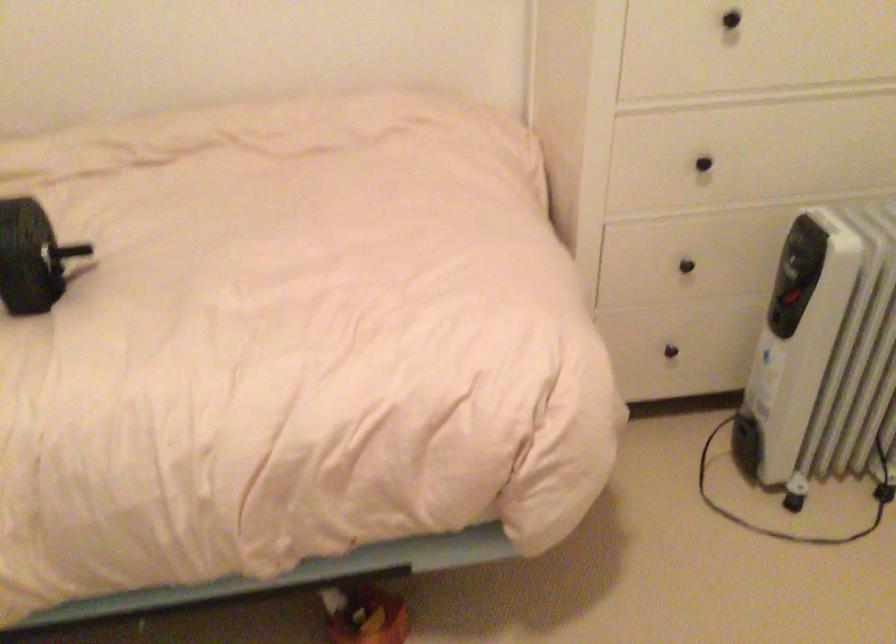
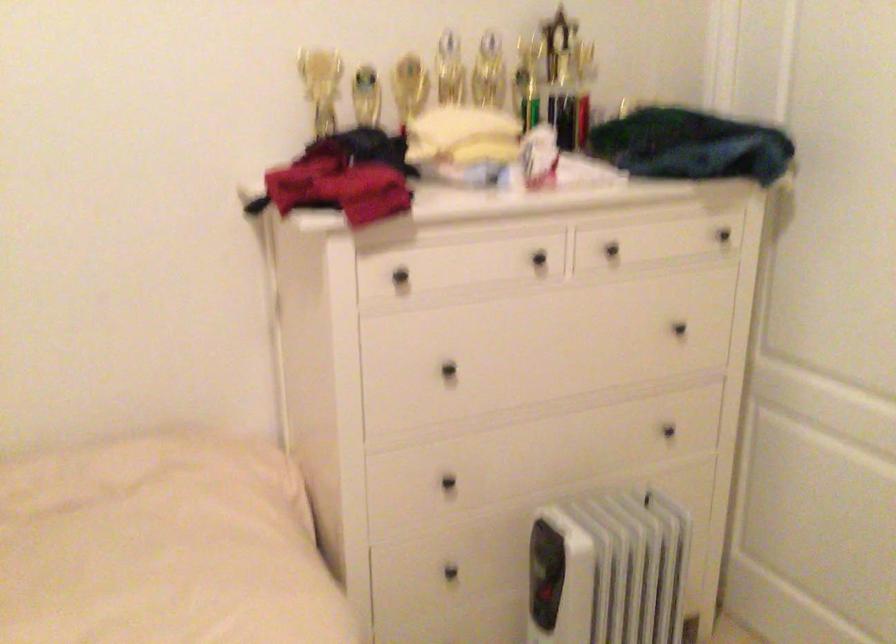
Based on the continuous images, in which direction is the camera rotating?

The camera's rotation is toward right-up.